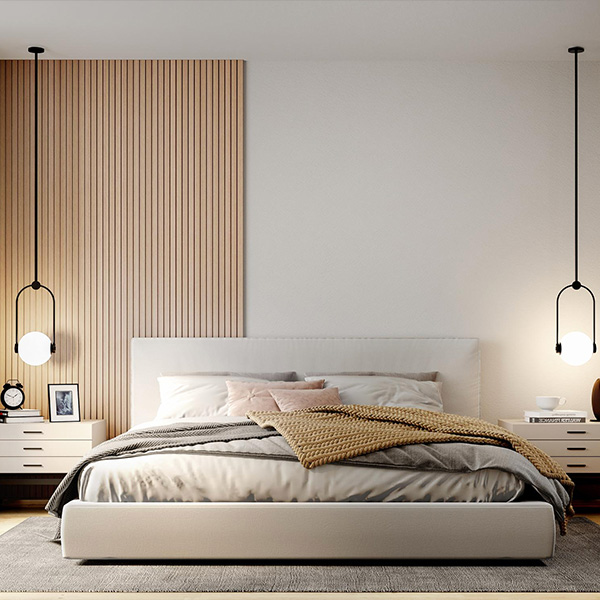
This screenshot has height=600, width=600. What are the coordinates of `place to lie down` in the screenshot? It's located at (236, 416).